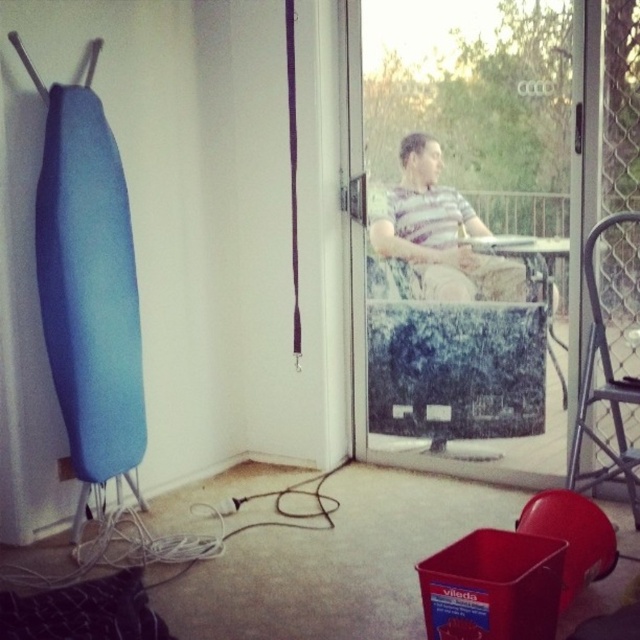
Which is more to the left, striped fabric shirt at center or metallic silver chair at right?

striped fabric shirt at center

Who is more forward, (445, 284) or (595, 282)?

Positioned in front is point (595, 282).

Which is in front, point (518, 280) or point (608, 352)?

Point (608, 352)

Find the location of a particular element. The height and width of the screenshot is (640, 640). striped fabric shirt at center is located at coordinates (436, 234).

Between transparent glass door at center and striped fabric shirt at center, which one appears on the right side from the viewer's perspective?

transparent glass door at center is more to the right.

Where is `transparent glass door at center`? The width and height of the screenshot is (640, 640). transparent glass door at center is located at coordinates (458, 237).

The width and height of the screenshot is (640, 640). I want to click on transparent glass door at center, so click(x=458, y=237).

Which is above, transparent glass door at center or metallic silver chair at right?

transparent glass door at center

Which is behind, point (380, 164) or point (632, 472)?

The point (380, 164) is more distant.

Is point (500, 380) positioned behind point (627, 216)?

Yes, point (500, 380) is behind point (627, 216).

The width and height of the screenshot is (640, 640). What are the coordinates of `transparent glass door at center` in the screenshot? It's located at (458, 237).